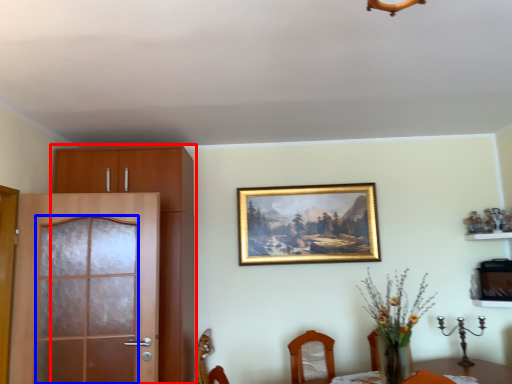
Question: Which object appears farthest to the camera in this image, cabinetry (highlighted by a red box) or screen door (highlighted by a blue box)?

Choices:
 (A) cabinetry
 (B) screen door

Answer: (A)